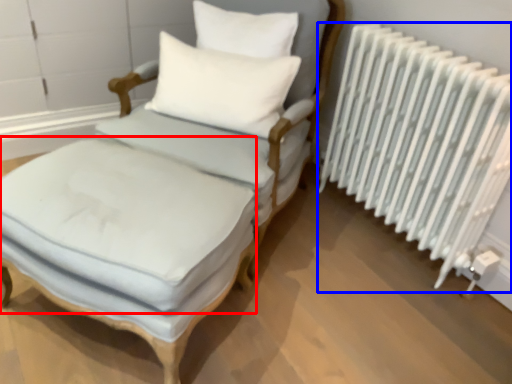
Question: Which object appears farthest to the camera in this image, mattress (highlighted by a red box) or radiator (highlighted by a blue box)?

Choices:
 (A) mattress
 (B) radiator

Answer: (B)